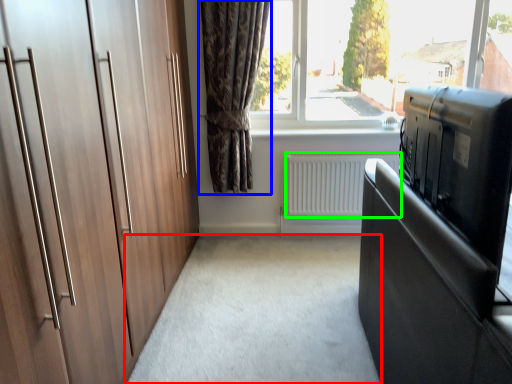
Question: Which object is positioned closest to plain (highlighted by a red box)? Select from curtain (highlighted by a blue box) and radiator (highlighted by a green box).

Choices:
 (A) curtain
 (B) radiator

Answer: (B)